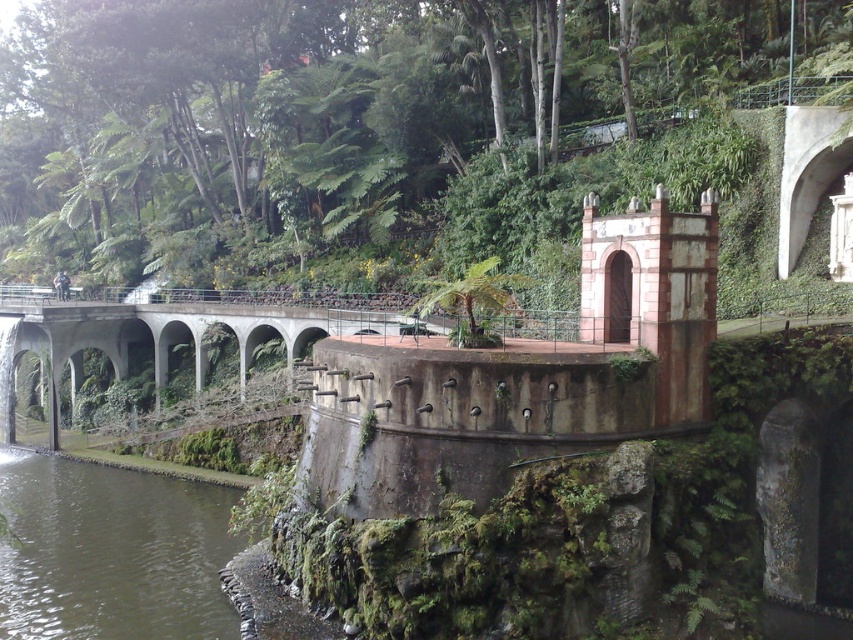
You are standing at the curved concrete structure with multiple arches in the foreground of the image. Looking towards the upper center, you notice a point marked at coordinates (401, 134). What type of object is located at this point?

The point at (401, 134) corresponds to green leafy vegetation at upper center.

From the picture: You are a maintenance worker needing to cross from the green mossy river at lower left to the concrete bridge at center. The path between them is 9.10 meters wide. If your equipment cart is 2 meters wide, can you safely navigate through this path?

The path between the green mossy river at lower left and the concrete bridge at center is 9.10 meters wide. Since the equipment cart is only 2 meters wide, there is ample space to safely navigate through the path.

You are standing at the center of the curved concrete structure and looking towards the upper center. What is the exact coordinate of the green leafy vegetation at upper center in the image?

The green leafy vegetation at upper center is located at coordinate point (401, 134).